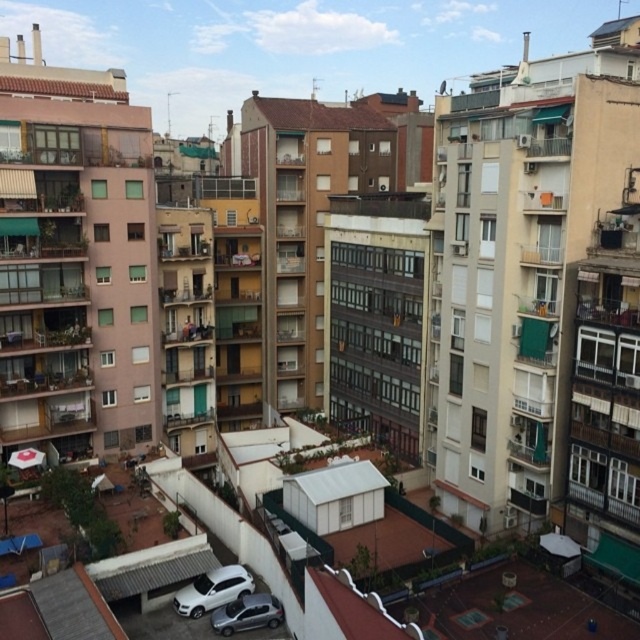
What do you see at coordinates (212, 589) in the screenshot? The height and width of the screenshot is (640, 640). I see `white matte suv at center` at bounding box center [212, 589].

Does point (193, 600) come in front of point (268, 600)?

No, (193, 600) is further to viewer.

Where is `white matte suv at center`? The height and width of the screenshot is (640, 640). white matte suv at center is located at coordinates (x=212, y=589).